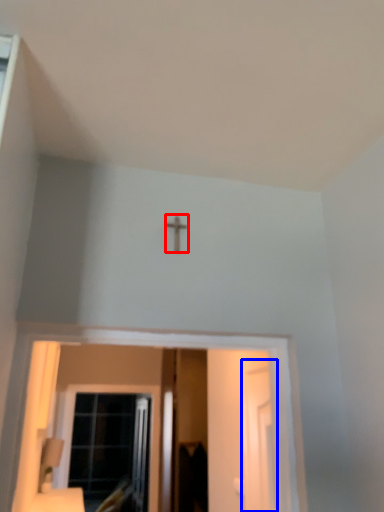
Question: Which point is further to the camera, crucifix (highlighted by a red box) or screen door (highlighted by a blue box)?

Choices:
 (A) crucifix
 (B) screen door

Answer: (B)